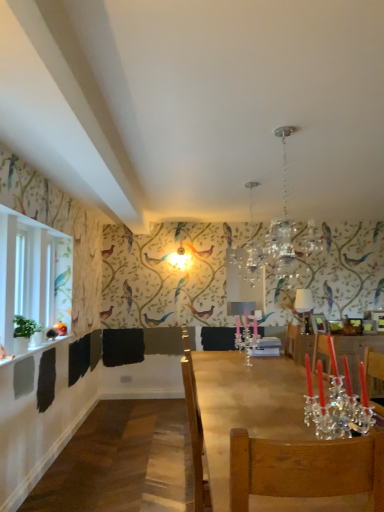
Question: Can you confirm if clear crystal candle holder at center is bigger than crystal glass chandelier at upper center?

Choices:
 (A) yes
 (B) no

Answer: (B)

Question: From a real-world perspective, does clear crystal candle holder at center sit lower than crystal glass chandelier at upper center?

Choices:
 (A) no
 (B) yes

Answer: (B)

Question: Does clear crystal candle holder at center have a greater height compared to crystal glass chandelier at upper center?

Choices:
 (A) yes
 (B) no

Answer: (B)

Question: Is clear crystal candle holder at center to the right of crystal glass chandelier at upper center from the viewer's perspective?

Choices:
 (A) yes
 (B) no

Answer: (B)

Question: Considering the relative positions of clear crystal candle holder at center and crystal glass chandelier at upper center in the image provided, is clear crystal candle holder at center behind crystal glass chandelier at upper center?

Choices:
 (A) no
 (B) yes

Answer: (B)

Question: From the image's perspective, is white glossy lampshade at upper center above or below clear crystal candle holder at center?

Choices:
 (A) above
 (B) below

Answer: (A)

Question: Considering the relative positions of white glossy lampshade at upper center and clear crystal candle holder at center in the image provided, is white glossy lampshade at upper center to the left or to the right of clear crystal candle holder at center?

Choices:
 (A) left
 (B) right

Answer: (B)

Question: In terms of width, does white glossy lampshade at upper center look wider or thinner when compared to clear crystal candle holder at center?

Choices:
 (A) wide
 (B) thin

Answer: (B)

Question: Considering the positions of point (296, 302) and point (240, 342), is point (296, 302) closer or farther from the camera than point (240, 342)?

Choices:
 (A) closer
 (B) farther

Answer: (A)

Question: From a real-world perspective, relative to wooden table at center, is clear crystal candle holder at center vertically above or below?

Choices:
 (A) above
 (B) below

Answer: (A)

Question: Relative to wooden table at center, is clear crystal candle holder at center in front or behind?

Choices:
 (A) front
 (B) behind

Answer: (B)

Question: Is clear crystal candle holder at center inside or outside of wooden table at center?

Choices:
 (A) inside
 (B) outside

Answer: (B)

Question: Is point (244, 315) positioned closer to the camera than point (223, 406)?

Choices:
 (A) closer
 (B) farther

Answer: (B)

Question: From the image's perspective, is white glossy lampshade at upper center located above or below crystal glass chandelier at upper center?

Choices:
 (A) above
 (B) below

Answer: (B)

Question: Does point (304, 294) appear closer or farther from the camera than point (317, 237)?

Choices:
 (A) closer
 (B) farther

Answer: (B)